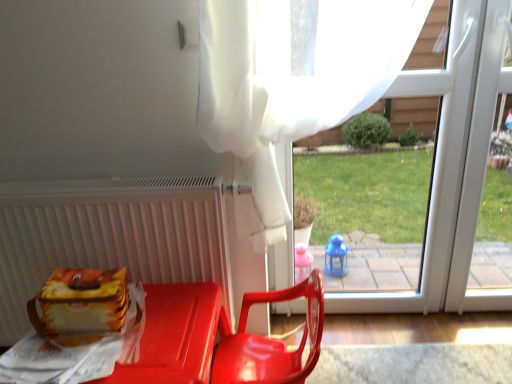
Question: Considering the relative sizes of matte plastic chair at lower center and transparent plastic window at center in the image provided, is matte plastic chair at lower center smaller than transparent plastic window at center?

Choices:
 (A) no
 (B) yes

Answer: (A)

Question: Could transparent plastic window at center be considered to be inside matte plastic chair at lower center?

Choices:
 (A) yes
 (B) no

Answer: (B)

Question: From a real-world perspective, is matte plastic chair at lower center positioned under transparent plastic window at center based on gravity?

Choices:
 (A) yes
 (B) no

Answer: (A)

Question: Is matte plastic chair at lower center bigger than transparent plastic window at center?

Choices:
 (A) no
 (B) yes

Answer: (B)

Question: Is matte plastic chair at lower center far away from transparent plastic window at center?

Choices:
 (A) no
 (B) yes

Answer: (A)

Question: Is matte plastic chair at lower center taller than transparent plastic window at center?

Choices:
 (A) yes
 (B) no

Answer: (B)

Question: Is matte plastic lunch box at lower left wider than matte plastic chair at lower center?

Choices:
 (A) no
 (B) yes

Answer: (A)

Question: Does matte plastic lunch box at lower left lie behind matte plastic chair at lower center?

Choices:
 (A) yes
 (B) no

Answer: (A)

Question: From a real-world perspective, is matte plastic lunch box at lower left below matte plastic chair at lower center?

Choices:
 (A) no
 (B) yes

Answer: (A)

Question: Is matte plastic lunch box at lower left placed right next to matte plastic chair at lower center?

Choices:
 (A) no
 (B) yes

Answer: (A)

Question: Does matte plastic lunch box at lower left come in front of matte plastic chair at lower center?

Choices:
 (A) no
 (B) yes

Answer: (A)

Question: Is matte plastic lunch box at lower left positioned beyond the bounds of matte plastic chair at lower center?

Choices:
 (A) no
 (B) yes

Answer: (B)

Question: From the image's perspective, is transparent plastic window at center over glossy plastic chair at center?

Choices:
 (A) no
 (B) yes

Answer: (B)